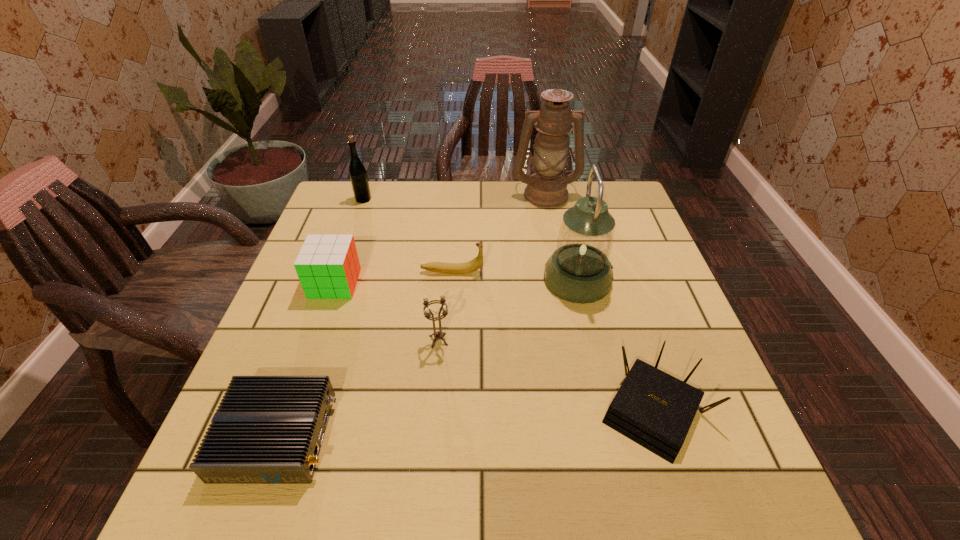
Find the location of a particular element. The height and width of the screenshot is (540, 960). vacant space at the near edge of the desktop is located at coordinates (444, 487).

You are a GUI agent. You are given a task and a screenshot of the screen. Output one action in this format:
    pyautogui.click(x=<x>, y=<y>)
    Task: Click on the blank space at the left edge of the desktop
    The width and height of the screenshot is (960, 540).
    Given the screenshot: What is the action you would take?
    point(283,325)

At what (x,y) coordinates should I click in order to perform the action: click on free space at the right edge of the desktop. Please return your answer as a coordinate pair (x, y). Looking at the image, I should click on (626, 304).

Where is `vacant space at the near right corner of the desktop`? vacant space at the near right corner of the desktop is located at coordinates (729, 476).

In order to click on free point between the right router and the oil lamp in this screenshot , I will do `click(601, 302)`.

Where is `vacant space that's between the third tallest object and the right router`? This screenshot has height=540, width=960. vacant space that's between the third tallest object and the right router is located at coordinates (510, 305).

Locate an element on the screen. This screenshot has width=960, height=540. vacant space that's between the oil lamp and the banana is located at coordinates (499, 233).

Find the location of a particular element. The image size is (960, 540). vacant space that's between the banana and the shortest object is located at coordinates (365, 354).

At what (x,y) coordinates should I click in order to perform the action: click on vacant area that lies between the cube and the banana. Please return your answer as a coordinate pair (x, y). Looking at the image, I should click on (394, 278).

At what (x,y) coordinates should I click in order to perform the action: click on free space between the shorter router and the third tallest object. Please return your answer as a coordinate pair (x, y). This screenshot has width=960, height=540. Looking at the image, I should click on (321, 318).